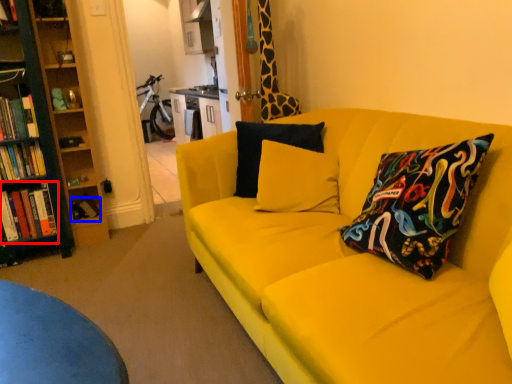
Question: Which object appears closest to the camera in this image, book (highlighted by a red box) or book (highlighted by a blue box)?

Choices:
 (A) book
 (B) book

Answer: (A)